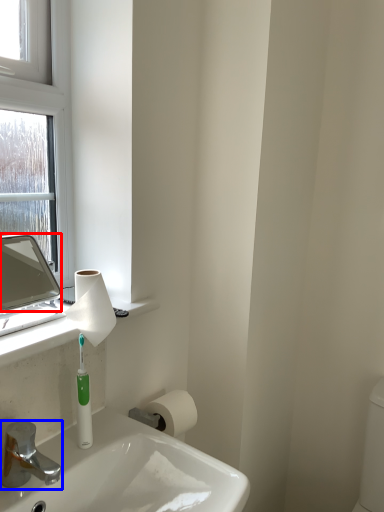
Question: Which point is further to the camera, mirror (highlighted by a red box) or tap (highlighted by a blue box)?

Choices:
 (A) mirror
 (B) tap

Answer: (A)